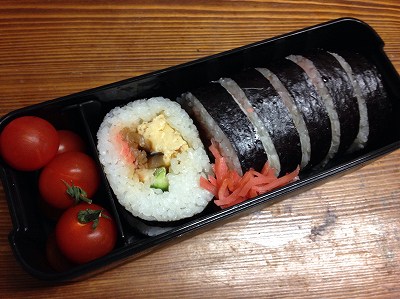
Locate an element on the screen. table is located at coordinates (260, 274), (126, 52).